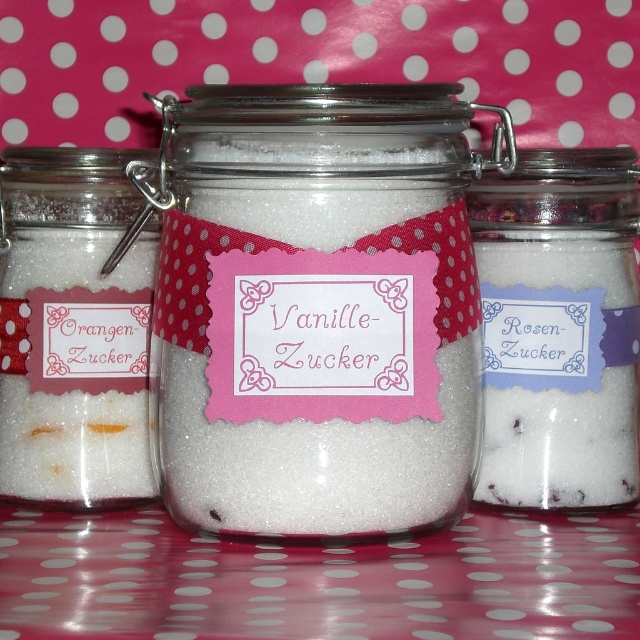
You are standing in front of the three sugar jars and want to place a decorative ribbon on the point that is closer to you. Which point should you choose between point (451, 244) and point (600, 333)?

You should choose point (451, 244) because it is closer to the viewer than point (600, 333).